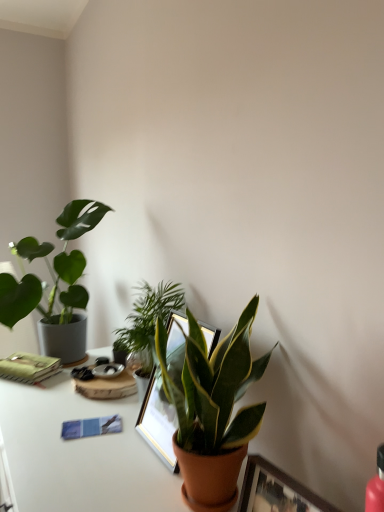
Question: Is green glossy plant at center, marked as the second houseplant in a left-to-right arrangement, facing towards green matte plant at center, which ranks as the third houseplant in back-to-front order?

Choices:
 (A) yes
 (B) no

Answer: (B)

Question: Is green glossy plant at center, marked as the second houseplant in a left-to-right arrangement, smaller than green matte plant at center, placed as the 1th houseplant when sorted from right to left?

Choices:
 (A) no
 (B) yes

Answer: (B)

Question: From the image's perspective, is green glossy plant at center, acting as the second houseplant starting from the right, on top of green matte plant at center, the 1th houseplant positioned from the front?

Choices:
 (A) yes
 (B) no

Answer: (A)

Question: Is green glossy plant at center, the 2th houseplant from the front, positioned far away from green matte plant at center, placed as the 1th houseplant when sorted from right to left?

Choices:
 (A) no
 (B) yes

Answer: (A)

Question: Would you say green matte plant at center, the 1th houseplant positioned from the front, is part of green glossy plant at center, the 2th houseplant when ordered from back to front,'s contents?

Choices:
 (A) yes
 (B) no

Answer: (B)

Question: Is green matte notebook at left in front of or behind green glossy plant at center, acting as the second houseplant starting from the right, in the image?

Choices:
 (A) behind
 (B) front

Answer: (A)

Question: From a real-world perspective, is green matte notebook at left positioned above or below green glossy plant at center, the 2th houseplant from the front?

Choices:
 (A) below
 (B) above

Answer: (A)

Question: Is point coord(13,370) closer or farther from the camera than point coord(160,303)?

Choices:
 (A) closer
 (B) farther

Answer: (B)

Question: Is green matte notebook at left bigger or smaller than green glossy plant at center, marked as the second houseplant in a left-to-right arrangement?

Choices:
 (A) big
 (B) small

Answer: (B)

Question: Is point tap(137, 301) positioned closer to the camera than point tap(233, 450)?

Choices:
 (A) farther
 (B) closer

Answer: (A)

Question: Is green glossy plant at center, acting as the second houseplant starting from the right, in front of or behind green matte plant at center, the 1th houseplant positioned from the front, in the image?

Choices:
 (A) behind
 (B) front

Answer: (A)

Question: From the image's perspective, is green glossy plant at center, acting as the second houseplant starting from the right, located above or below green matte plant at center, placed as the 1th houseplant when sorted from right to left?

Choices:
 (A) below
 (B) above

Answer: (B)

Question: In terms of size, does green glossy plant at center, the 2th houseplant when ordered from back to front, appear bigger or smaller than green matte plant at center, which ranks as the third houseplant in back-to-front order?

Choices:
 (A) big
 (B) small

Answer: (B)

Question: Is green glossy plant at center, the 2th houseplant from the front, in front of or behind green matte plant at left, positioned as the third houseplant in right-to-left order, in the image?

Choices:
 (A) front
 (B) behind

Answer: (A)

Question: Is green glossy plant at center, marked as the second houseplant in a left-to-right arrangement, bigger or smaller than green matte plant at left, the 1th houseplant in the back-to-front sequence?

Choices:
 (A) small
 (B) big

Answer: (A)